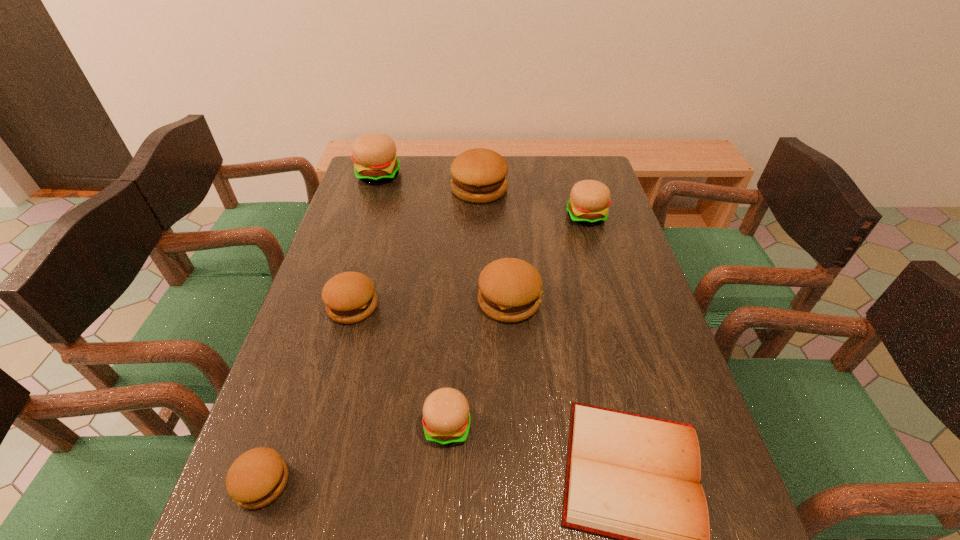
I want to click on free location at the far edge, so coord(423,166).

The width and height of the screenshot is (960, 540). I want to click on free region at the left edge of the desktop, so click(x=378, y=242).

In the image, there is a desktop. In order to click on vacant space at the right edge in this screenshot , I will do `click(612, 198)`.

In the image, there is a desktop. Where is `vacant space at the far left corner`? vacant space at the far left corner is located at coordinates (354, 186).

This screenshot has height=540, width=960. Find the location of `vacant space at the far right corner of the desktop`. vacant space at the far right corner of the desktop is located at coordinates (557, 156).

Image resolution: width=960 pixels, height=540 pixels. Identify the location of vacant area between the third biggest brown hamburger and the leftmost beige hamburger. (366, 241).

Identify the location of unoccupied area between the leftmost beige hamburger and the farthest brown hamburger. The image size is (960, 540). (428, 183).

What are the coordinates of `free space between the second smallest brown hamburger and the third smallest brown hamburger` in the screenshot? It's located at (431, 304).

Identify the location of empty location between the second biggest beige hamburger and the seventh tallest object. Image resolution: width=960 pixels, height=540 pixels. (424, 349).

The height and width of the screenshot is (540, 960). Find the location of `free spot between the leftmost beige hamburger and the second smallest brown hamburger`. free spot between the leftmost beige hamburger and the second smallest brown hamburger is located at coordinates (366, 241).